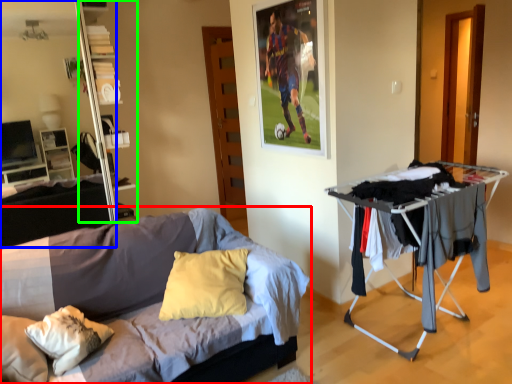
Question: Estimate the real-world distances between objects in this image. Which object is farther from bed (highlighted by a red box), entertainment center (highlighted by a blue box) or shelf (highlighted by a green box)?

Choices:
 (A) entertainment center
 (B) shelf

Answer: (A)